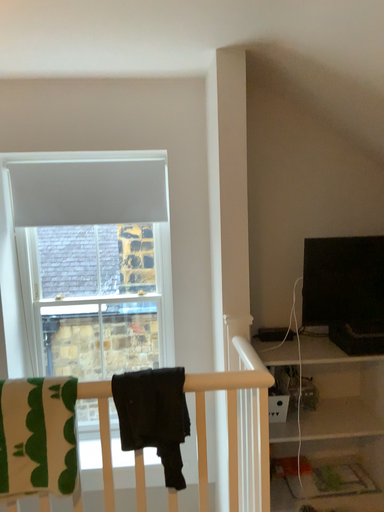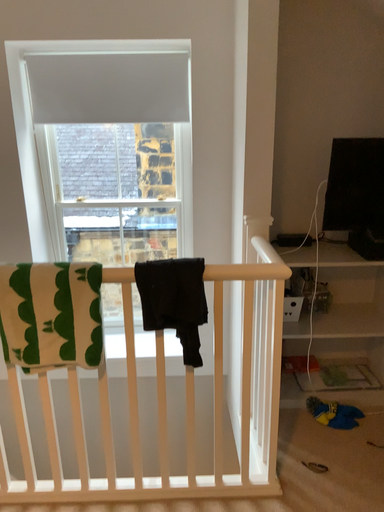
Question: Which way did the camera rotate in the video?

Choices:
 (A) rotated upward
 (B) rotated downward

Answer: (B)